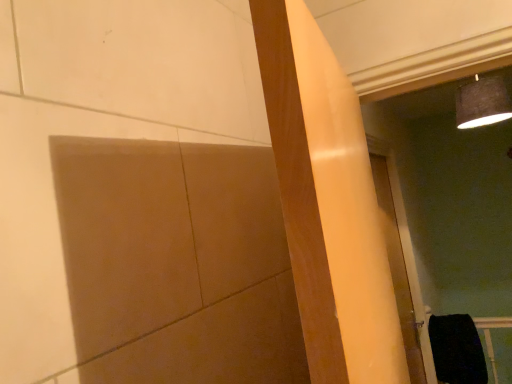
Question: Considering the positions of point (388, 175) and point (449, 347), is point (388, 175) closer or farther from the camera than point (449, 347)?

Choices:
 (A) farther
 (B) closer

Answer: (B)

Question: Is white glossy door at right inside or outside of black fabric at lower right?

Choices:
 (A) inside
 (B) outside

Answer: (B)

Question: Considering the positions of white glossy door at right and black fabric at lower right in the image, is white glossy door at right bigger or smaller than black fabric at lower right?

Choices:
 (A) small
 (B) big

Answer: (B)

Question: From a real-world perspective, relative to white glossy door at right, is black fabric at lower right vertically above or below?

Choices:
 (A) below
 (B) above

Answer: (A)

Question: Is point coord(454,352) closer or farther from the camera than point coord(395,259)?

Choices:
 (A) farther
 (B) closer

Answer: (A)

Question: Is black fabric at lower right taller or shorter than white glossy door at right?

Choices:
 (A) short
 (B) tall

Answer: (A)

Question: From the image's perspective, is black fabric at lower right located above or below white glossy door at right?

Choices:
 (A) below
 (B) above

Answer: (A)